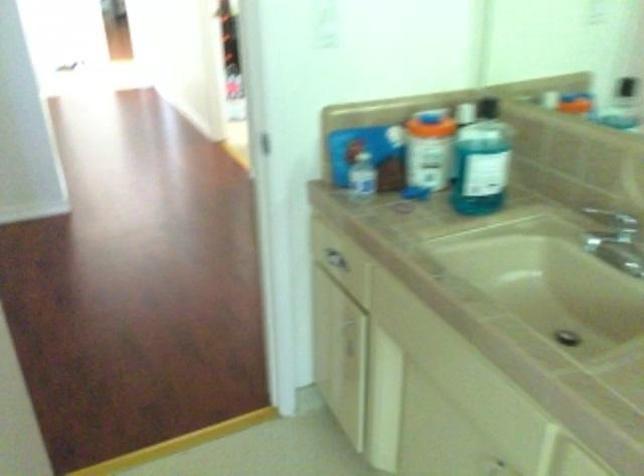
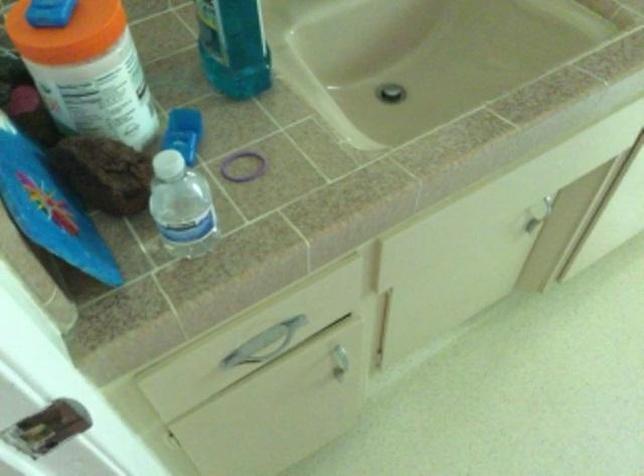
Where in the second image is the point corresponding to point 411,185 from the first image?

(104, 173)